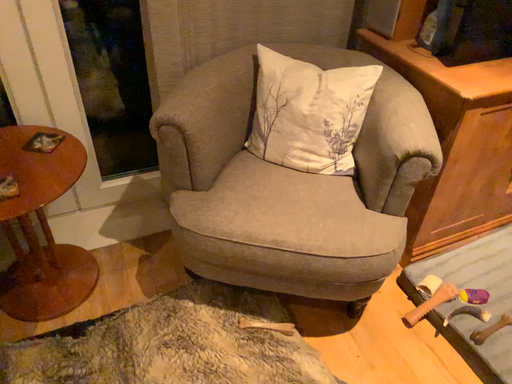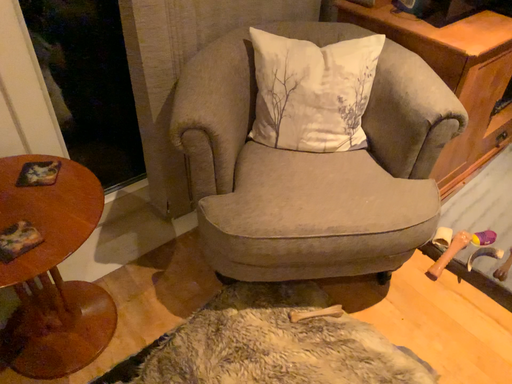
Question: Which way did the camera rotate in the video?

Choices:
 (A) rotated left
 (B) rotated right

Answer: (B)